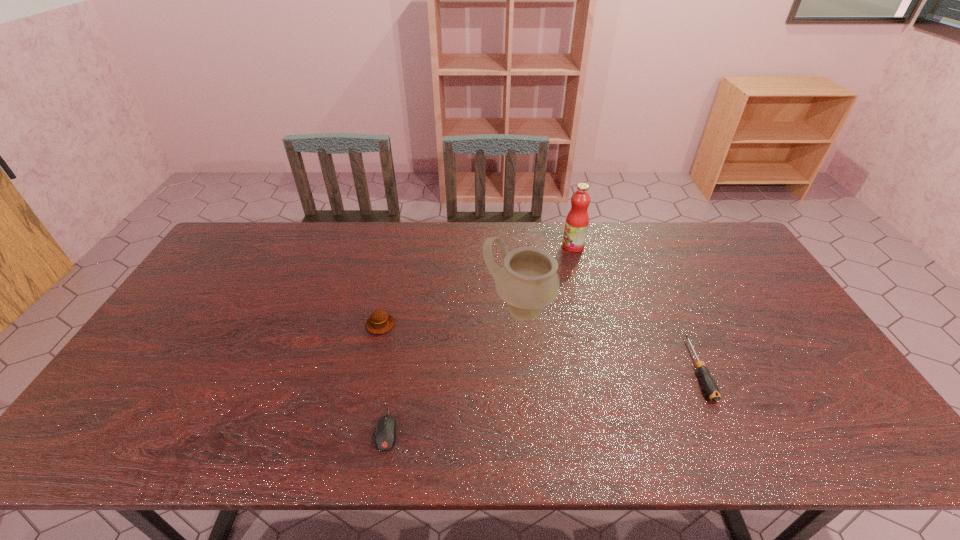
In order to click on fruit juice in this screenshot , I will do `click(576, 225)`.

I want to click on the farthest object, so click(x=576, y=225).

This screenshot has height=540, width=960. I want to click on pottery, so click(x=528, y=281).

Locate an element on the screen. This screenshot has width=960, height=540. muffin is located at coordinates (380, 321).

You are a GUI agent. You are given a task and a screenshot of the screen. Output one action in this format:
    pyautogui.click(x=<x>, y=<y>)
    Task: Click on the leftmost object
    The image size is (960, 540).
    Given the screenshot: What is the action you would take?
    pyautogui.click(x=380, y=321)

Locate an element on the screen. This screenshot has width=960, height=540. screwdriver is located at coordinates (710, 386).

Find the location of a particular element. the fourth farthest object is located at coordinates [710, 386].

In order to click on the nearest object in this screenshot , I will do `click(385, 437)`.

The width and height of the screenshot is (960, 540). Identify the location of computer mouse. pos(385,437).

The image size is (960, 540). In order to click on vacant area situated 0.070m on the front label of the fourth object from left to right in this screenshot , I will do `click(542, 246)`.